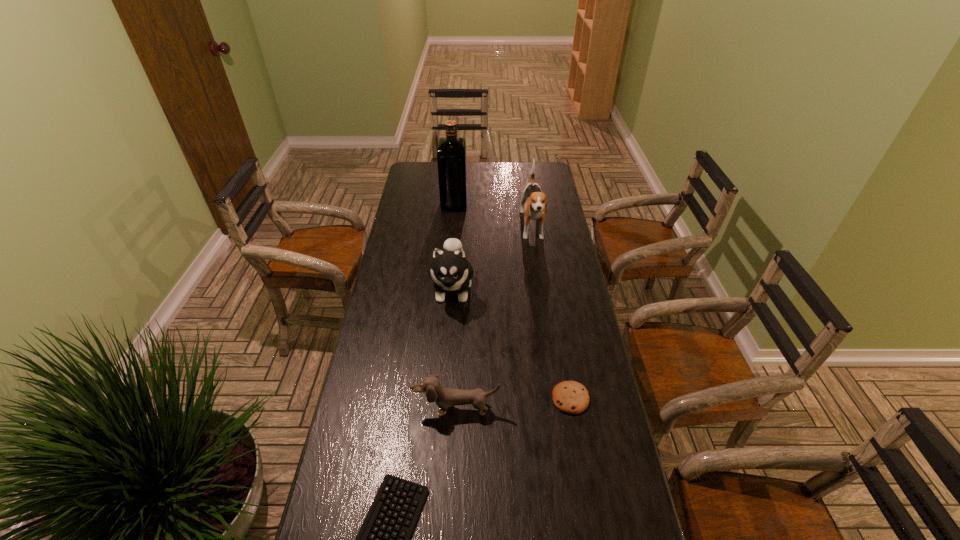
Where is `vacant space that satisfies the following two spatial constraints: 1. at the face of the farthest puppy; 2. on the left side of the fifth tallest object`? The image size is (960, 540). vacant space that satisfies the following two spatial constraints: 1. at the face of the farthest puppy; 2. on the left side of the fifth tallest object is located at coordinates (557, 399).

Where is `free space that satisfies the following two spatial constraints: 1. on the front label of the liquor; 2. on the back side of the cookie`? free space that satisfies the following two spatial constraints: 1. on the front label of the liquor; 2. on the back side of the cookie is located at coordinates (439, 399).